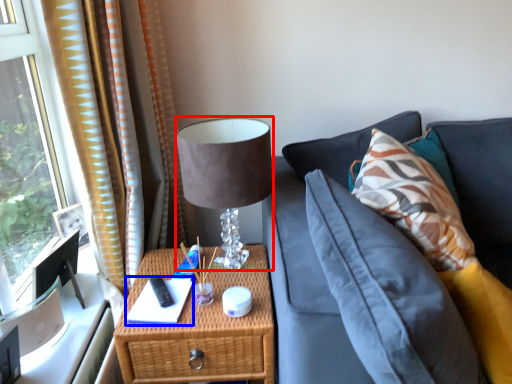
Question: Which object is closer to the camera taking this photo, table lamp (highlighted by a red box) or book (highlighted by a blue box)?

Choices:
 (A) table lamp
 (B) book

Answer: (A)